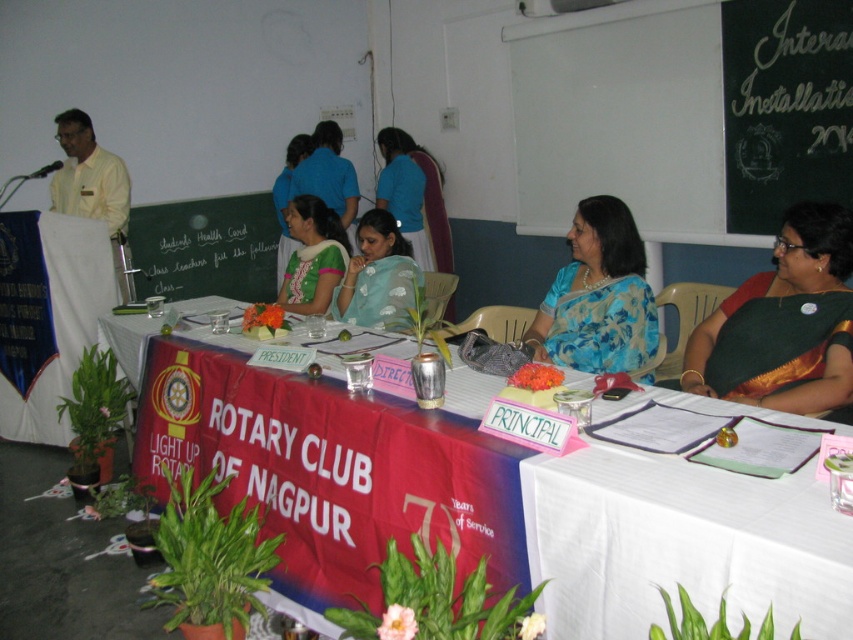
You are attending a Rotary Club of Nagpur event and notice the green chalkboard at upper center and the light blue saree at center. Which object is taller?

The green chalkboard at upper center is much taller than the light blue saree at center.

You are organizing a photo shoot for the Rotary Club of Nagpur and need to ensure that the red fabric tablecloth at center and the blue silk saree at center are positioned appropriately. Since the table is limited in space, which object should you place first to accommodate both items without overlapping?

The red fabric tablecloth at center should be placed first because its width is larger than the blue silk saree at center, ensuring there is enough space for both items.

You are organizing a photo shoot for the Rotary Club of Nagpur and need to place a decorative item on the table. The table has both the red fabric tablecloth at center and the blue silk saree at center. Which of these two items should you place the decorative item on if you want it to be more prominent?

The blue silk saree at center is larger than the red fabric tablecloth at center, so placing the decorative item on the blue silk saree at center would make it more prominent.